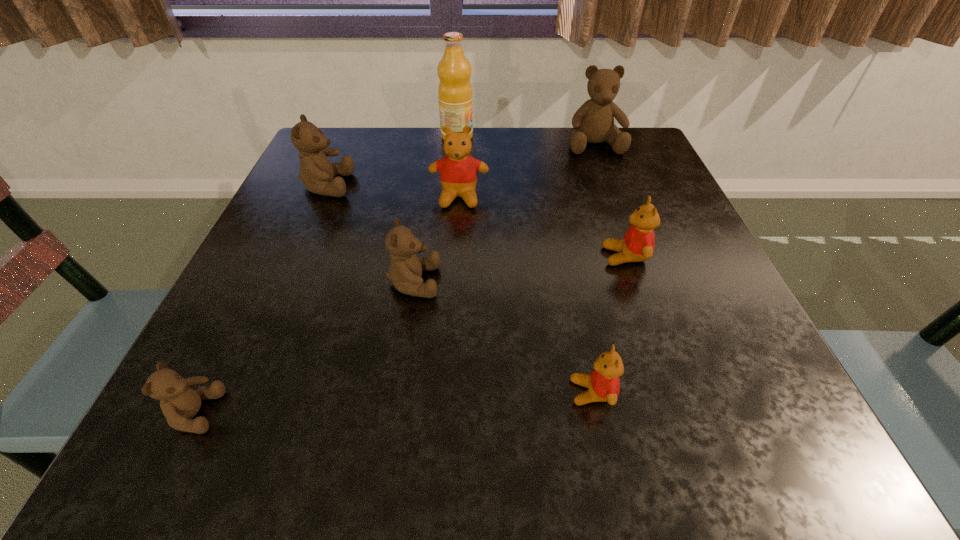
Locate an element on the screen. The height and width of the screenshot is (540, 960). free space that satisfies the following two spatial constraints: 1. on the front-facing side of the farthest teddy bear; 2. on the front-facing side of the third biggest brown teddy bear is located at coordinates (645, 282).

Where is `free space that satisfies the following two spatial constraints: 1. on the front-facing side of the farthest teddy bear; 2. on the front-facing side of the second biggest brown teddy bear`? This screenshot has height=540, width=960. free space that satisfies the following two spatial constraints: 1. on the front-facing side of the farthest teddy bear; 2. on the front-facing side of the second biggest brown teddy bear is located at coordinates pos(610,185).

Where is `free spot that satisfies the following two spatial constraints: 1. on the front-facing side of the leftmost red teddy bear; 2. on the front-facing side of the third brown teddy bear from left to right`? Image resolution: width=960 pixels, height=540 pixels. free spot that satisfies the following two spatial constraints: 1. on the front-facing side of the leftmost red teddy bear; 2. on the front-facing side of the third brown teddy bear from left to right is located at coordinates (454, 282).

You are a GUI agent. You are given a task and a screenshot of the screen. Output one action in this format:
    pyautogui.click(x=<x>, y=<y>)
    Task: Click on the blank space that satisfies the following two spatial constraints: 1. on the front-facing side of the biggest brown teddy bear; 2. on the front-facing side of the third nearest brown teddy bear
    Image resolution: width=960 pixels, height=540 pixels.
    Given the screenshot: What is the action you would take?
    pyautogui.click(x=610, y=185)